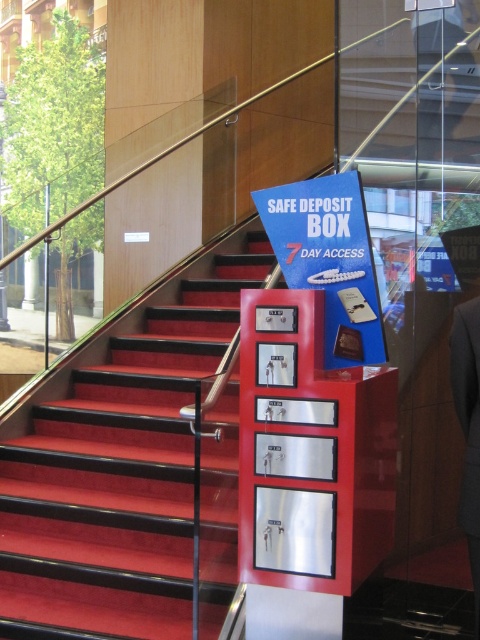
You are a customer entering the bank and need to locate the Safe Deposit Box services. You see the red carpeted stairs at center and the dark gray suit at center. Which object is bigger in size?

The red carpeted stairs at center is larger in size than the dark gray suit at center.

You are a customer entering the bank and see the red carpeted stairs at center and the dark gray suit at center. Which object is positioned to the left of the other?

The red carpeted stairs at center are to the left of the dark gray suit at center.

You are a security guard with a camera in hand, standing at the camera position in the image. You need to monitor the red carpeted stairs at center. Can you reach the stairs within 3 meters without moving the camera?

The red carpeted stairs at center and camera are 3.12 meters apart from each other, so you cannot reach the stairs within 3 meters without moving the camera.